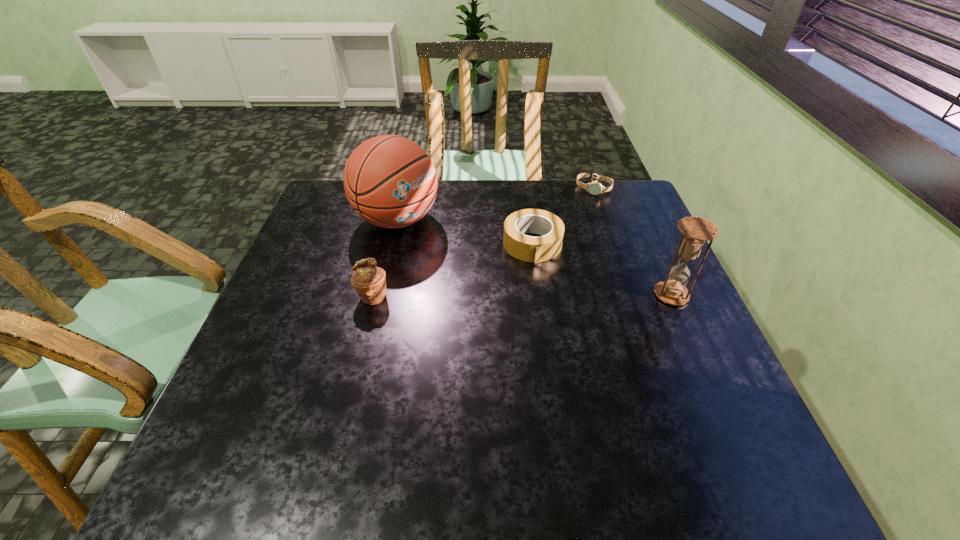
In order to click on free region at the far right corner of the desktop in this screenshot , I will do `click(596, 203)`.

Image resolution: width=960 pixels, height=540 pixels. In order to click on free point between the hourglass and the shortest object in this screenshot , I will do `click(633, 242)`.

Find the location of a particular element. vacant space that is in between the third object from right to left and the watch is located at coordinates pyautogui.click(x=564, y=217).

Locate an element on the screen. The height and width of the screenshot is (540, 960). empty space that is in between the second shortest object and the muffin is located at coordinates (452, 271).

At what (x,y) coordinates should I click in order to perform the action: click on empty space between the hourglass and the muffin. Please return your answer as a coordinate pair (x, y). The width and height of the screenshot is (960, 540). Looking at the image, I should click on (522, 295).

Where is `free spot between the watch and the fourth shortest object`? The height and width of the screenshot is (540, 960). free spot between the watch and the fourth shortest object is located at coordinates coord(633,242).

In order to click on empty space that is in between the third tallest object and the basketball in this screenshot , I will do `click(385, 258)`.

Identify the location of vacant point located between the third tallest object and the shortest object. The image size is (960, 540). [x=483, y=242].

This screenshot has width=960, height=540. I want to click on vacant region between the watch and the third object from right to left, so click(564, 217).

Locate an element on the screen. free space that is in between the third tallest object and the tallest object is located at coordinates (385, 258).